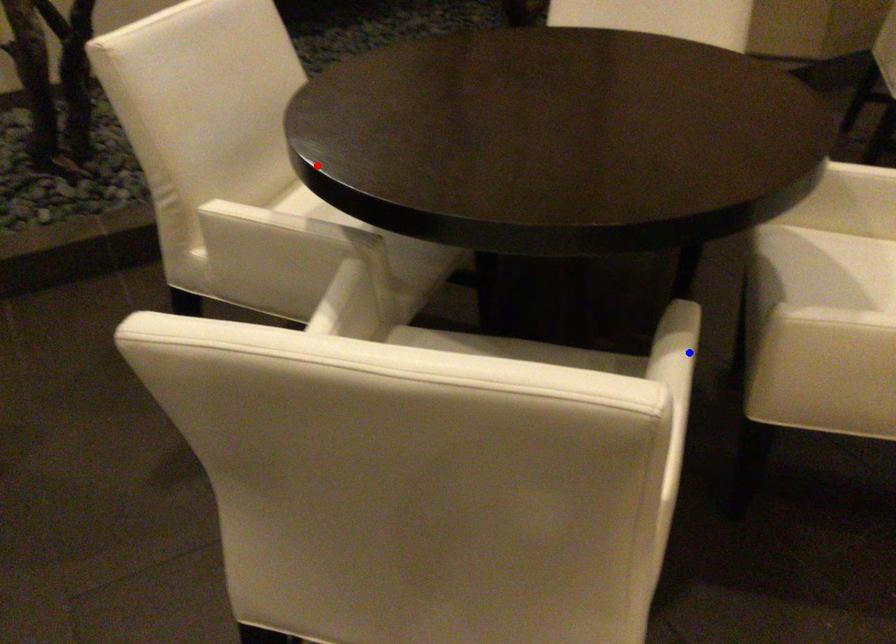
Question: Which of the two points in the image is closer to the camera?

Choices:
 (A) Blue point is closer.
 (B) Red point is closer.

Answer: (B)